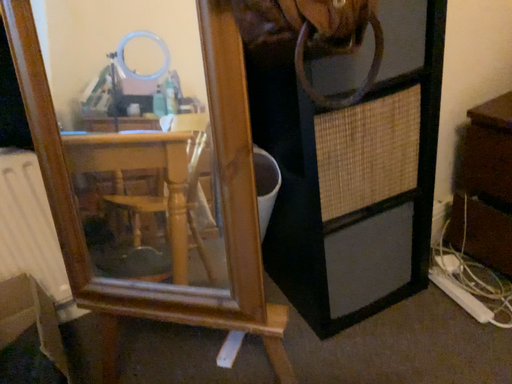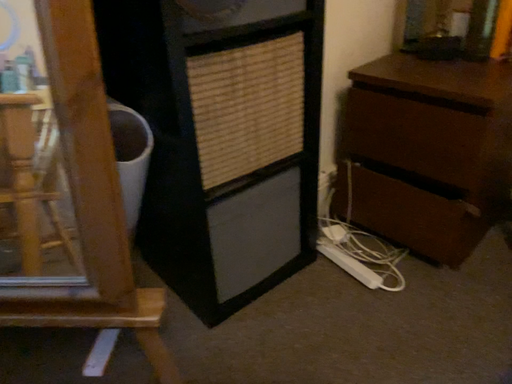
Question: Which way did the camera rotate in the video?

Choices:
 (A) rotated left
 (B) rotated right

Answer: (B)